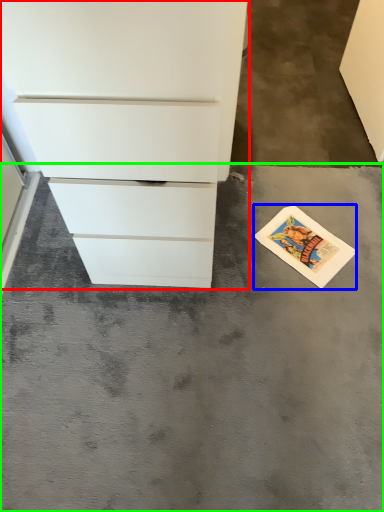
Question: Considering the real-world distances, which object is closest to chest of drawers (highlighted by a red box)? postcard (highlighted by a blue box) or concrete (highlighted by a green box).

Choices:
 (A) postcard
 (B) concrete

Answer: (B)